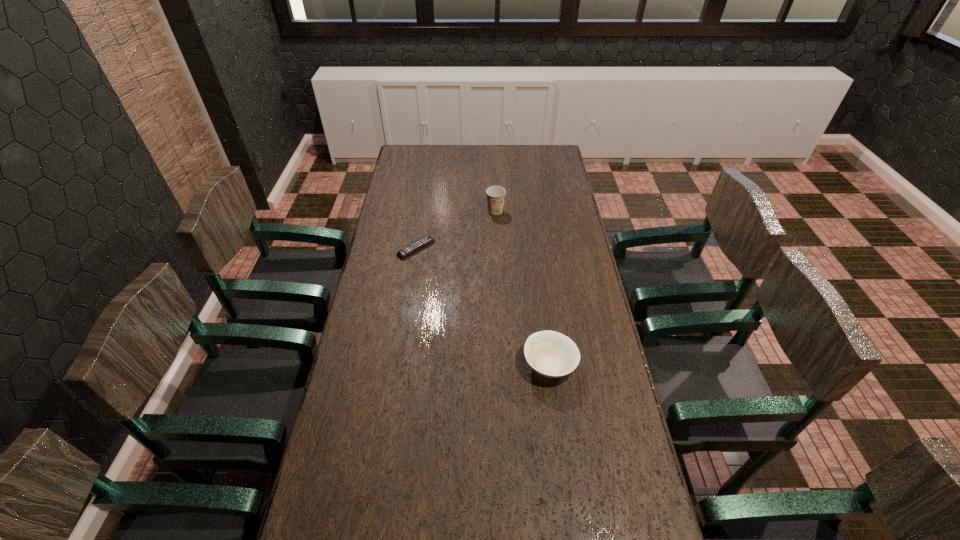
Where is `free space between the tallest object and the leftmost object`? free space between the tallest object and the leftmost object is located at coordinates point(456,230).

Locate an element on the screen. empty space between the second farthest object and the second object from right to left is located at coordinates (456, 230).

Image resolution: width=960 pixels, height=540 pixels. In order to click on the closest object to the leftmost object in this screenshot , I will do [x=495, y=194].

Find the location of a particular element. The image size is (960, 540). object that ranks as the closest to the second tallest object is located at coordinates (422, 242).

The image size is (960, 540). Find the location of `free point that satisfies the following two spatial constraints: 1. on the front side of the Dixie cup; 2. on the left side of the second tallest object`. free point that satisfies the following two spatial constraints: 1. on the front side of the Dixie cup; 2. on the left side of the second tallest object is located at coordinates (502, 365).

Identify the location of vacant space that satisfies the following two spatial constraints: 1. on the front side of the farthest object; 2. on the left side of the rightmost object. The image size is (960, 540). (502, 365).